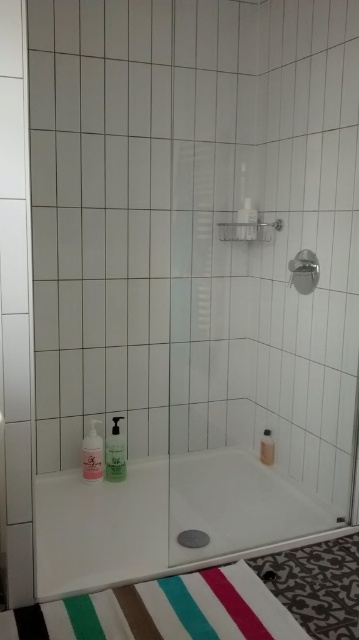
Question: Which point appears closest to the camera in this image?

Choices:
 (A) (119, 468)
 (B) (271, 449)
 (C) (306, 259)
 (D) (84, 474)

Answer: (C)

Question: Is metallic silver showerhead at upper right wider than translucent plastic pump bottle at lower left?

Choices:
 (A) yes
 (B) no

Answer: (B)

Question: Which of these objects is positioned farthest from the white glossy bathtub at lower center?

Choices:
 (A) translucent plastic soap dispenser at lower center
 (B) translucent plastic pump bottle at lower left

Answer: (A)

Question: Is translucent plastic soap dispenser at lower left bigger than translucent plastic soap dispenser at lower center?

Choices:
 (A) yes
 (B) no

Answer: (A)

Question: Which of the following is the closest to the observer?

Choices:
 (A) (268, 429)
 (B) (300, 275)
 (C) (105, 445)
 (D) (254, 484)

Answer: (B)

Question: From the image, what is the correct spatial relationship of white matte screen door at left in relation to metallic silver showerhead at upper right?

Choices:
 (A) left
 (B) right

Answer: (A)